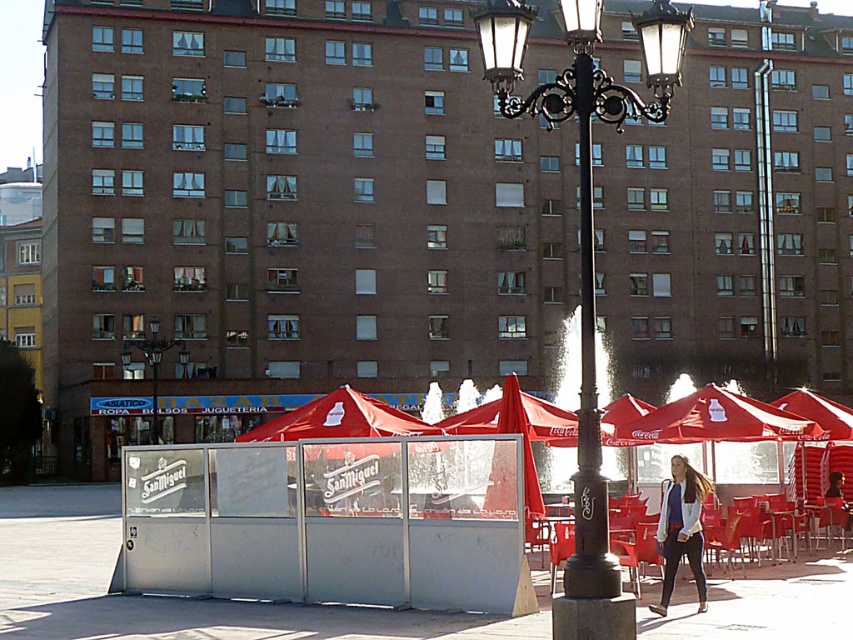
Question: Which object is farther from the camera taking this photo?

Choices:
 (A) bronze textured pole at center
 (B) metallic street light at center
 (C) black wrought iron street light at center
 (D) metallic silver pavement at lower center

Answer: (B)

Question: Is metallic silver pavement at lower center closer to the viewer compared to metallic street light at center?

Choices:
 (A) no
 (B) yes

Answer: (B)

Question: Which is farther from the black wrought iron street light at center?

Choices:
 (A) bronze textured pole at center
 (B) metallic silver pavement at lower center

Answer: (B)

Question: Is metallic silver pavement at lower center thinner than blue denim jacket at lower right?

Choices:
 (A) yes
 (B) no

Answer: (B)

Question: Is metallic silver pavement at lower center bigger than metallic street light at center?

Choices:
 (A) yes
 (B) no

Answer: (A)

Question: Among these points, which one is farthest from the camera?

Choices:
 (A) (662, 497)
 (B) (720, 612)
 (C) (593, 499)

Answer: (A)